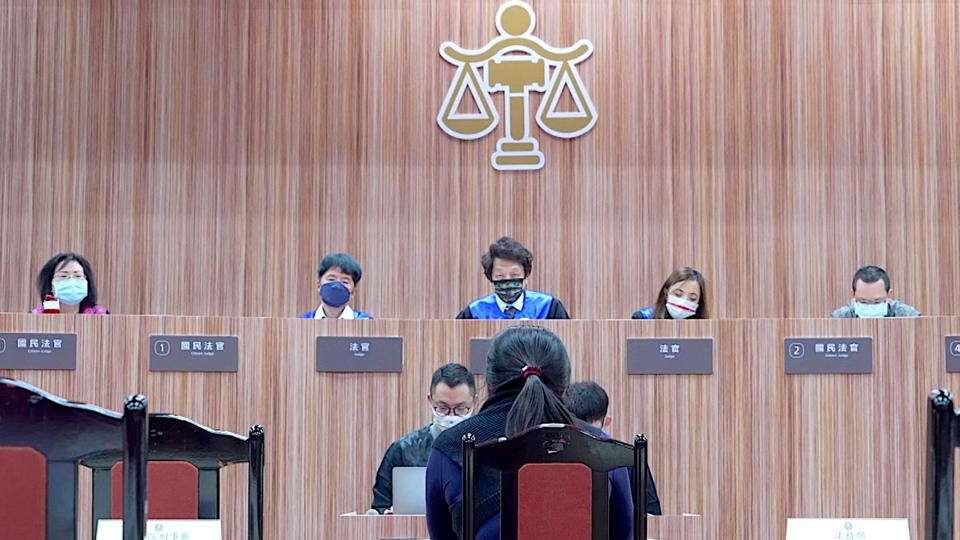
Identify the location of black chair. (108, 443), (185, 453), (519, 460).